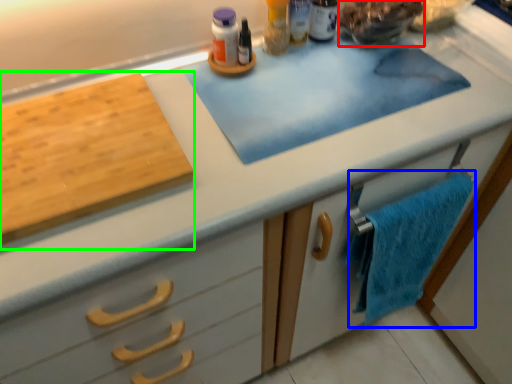
Question: Based on their relative distances, which object is farther from food (highlighted by a red box)? Choose from bath towel (highlighted by a blue box) and cutting board (highlighted by a green box).

Choices:
 (A) bath towel
 (B) cutting board

Answer: (B)